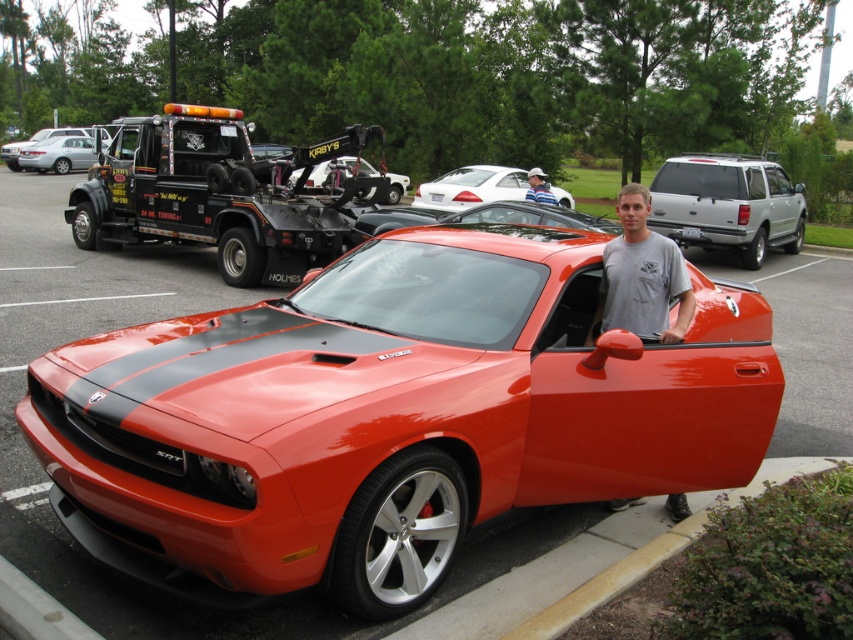
Does shiny orange car at center have a lesser width compared to concrete at lower right?

No, shiny orange car at center is not thinner than concrete at lower right.

Is shiny orange car at center positioned before concrete at lower right?

Yes.

What do you see at coordinates (389, 417) in the screenshot? I see `shiny orange car at center` at bounding box center [389, 417].

Identify the location of shiny orange car at center. (389, 417).

At what (x,y) coordinates should I click in order to perform the action: click on satin silver suv at right. Please return your answer as a coordinate pair (x, y). Looking at the image, I should click on (728, 204).

Locate an element on the screen. This screenshot has width=853, height=640. satin silver suv at right is located at coordinates (728, 204).

Which is behind, point (289, 173) or point (370, 195)?

The point (289, 173) is behind.

Is point (193, 204) farther from camera compared to point (314, 176)?

No, (193, 204) is in front of (314, 176).

The height and width of the screenshot is (640, 853). Identify the location of black matte tow truck at left. (223, 193).